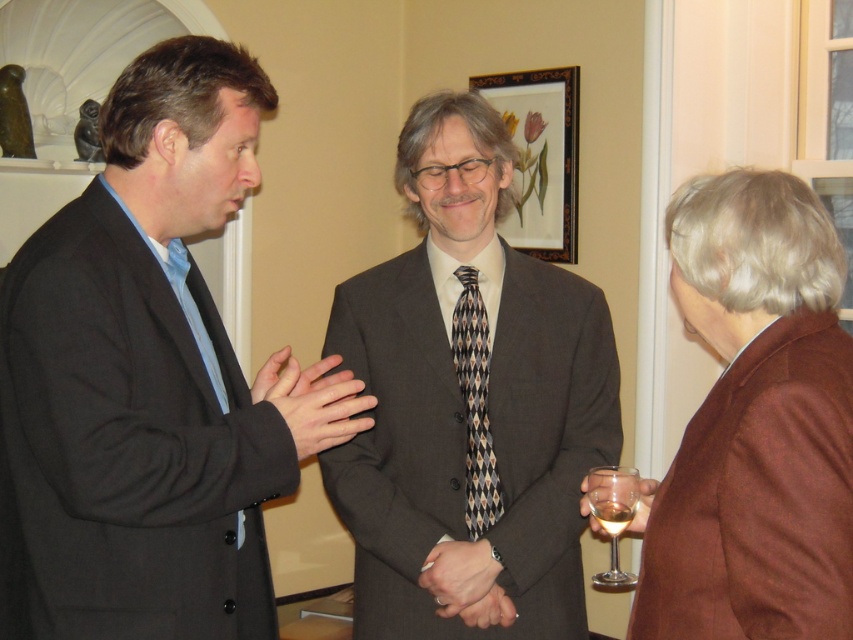
You are standing at the origin point of the image. Which direction should you move to reach the matte black suit at left?

You should move to the left to reach the matte black suit at left since it is located at point (x=154, y=374), which is to the left of the origin point.

You are a photographer setting up a shoot in the scene described. You want to position a light source so that it illuminates the matte black suit at left without casting a shadow from the clear glass wine glass at lower right. Is this possible given their positions?

The matte black suit at left is in front of the clear glass wine glass at lower right, so positioning a light source behind the wine glass would cast its shadow onto the suit. To avoid this, the light should be placed in a position where the wine glass does not block the light path to the suit, but since the suit is in front, the wine glass is behind it. Therefore, the shadow from the wine glass would not affect the suit, making it possible to illuminate the matte black suit at left without interference.